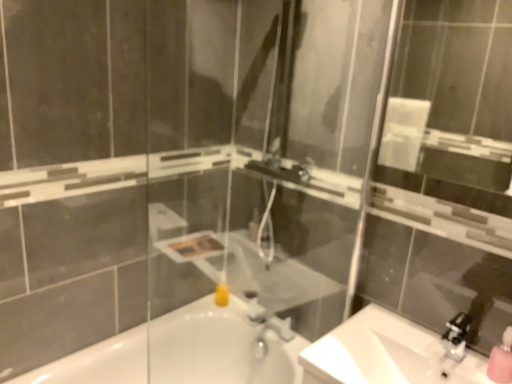
Where is `free space below clear glass mirror at upper center (from a real-world perspective)`? This screenshot has height=384, width=512. free space below clear glass mirror at upper center (from a real-world perspective) is located at coordinates (398, 327).